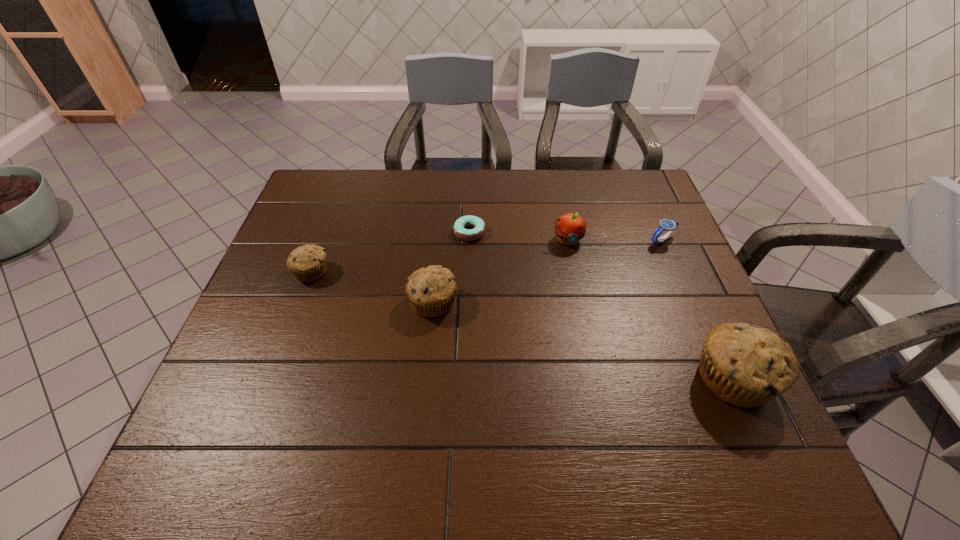
At what (x,y) coordinates should I click in order to perform the action: click on the third shortest object. Please return your answer as a coordinate pair (x, y). Image resolution: width=960 pixels, height=540 pixels. Looking at the image, I should click on (308, 263).

This screenshot has width=960, height=540. I want to click on the leftmost muffin, so click(308, 263).

The height and width of the screenshot is (540, 960). I want to click on the second tallest muffin, so click(x=431, y=290).

Where is `the rightmost muffin`? The image size is (960, 540). the rightmost muffin is located at coordinates coord(745,365).

In order to click on the nearest object in this screenshot , I will do `click(745, 365)`.

You are a GUI agent. You are given a task and a screenshot of the screen. Output one action in this format:
    pyautogui.click(x=<x>, y=<y>)
    Task: Click on the fourth object from left to right
    
    Given the screenshot: What is the action you would take?
    pyautogui.click(x=570, y=228)

Where is `doughnut`? Image resolution: width=960 pixels, height=540 pixels. doughnut is located at coordinates (459, 226).

In order to click on watch in this screenshot , I will do `click(671, 226)`.

You are a GUI agent. You are given a task and a screenshot of the screen. Output one action in this format:
    pyautogui.click(x=<x>, y=<y>)
    Task: Click on the free space located on the back of the leftmost muffin
    This screenshot has height=540, width=960.
    Given the screenshot: What is the action you would take?
    pyautogui.click(x=347, y=179)

Where is `free space located 0.250m on the left of the second muffin from left to right`? free space located 0.250m on the left of the second muffin from left to right is located at coordinates (308, 302).